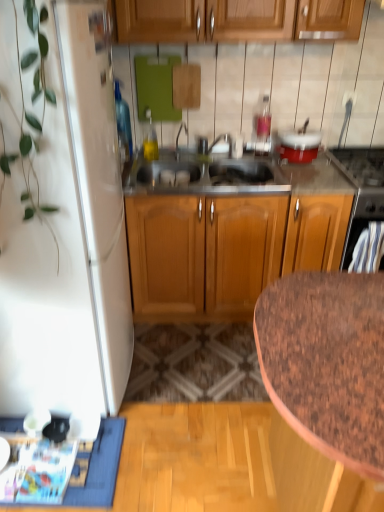
Where is `free space to the right of white matte refrigerator at left`? This screenshot has width=384, height=512. free space to the right of white matte refrigerator at left is located at coordinates (187, 381).